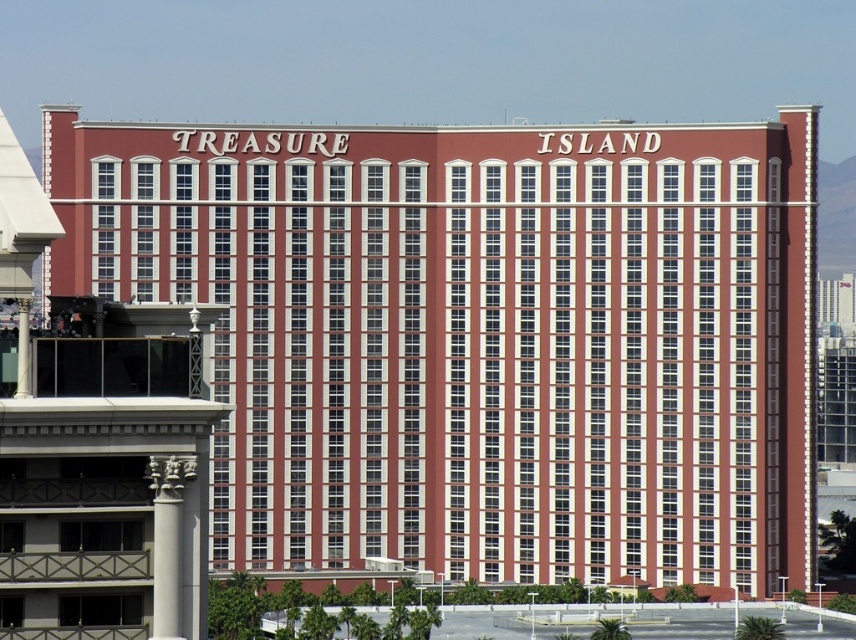
Question: Among these objects, which one is nearest to the camera?

Choices:
 (A) white glossy column at lower left
 (B) red brick building at center

Answer: (A)

Question: Can you confirm if red brick building at center is thinner than white glossy column at lower left?

Choices:
 (A) yes
 (B) no

Answer: (B)

Question: Is red brick building at center positioned behind white glossy column at lower left?

Choices:
 (A) no
 (B) yes

Answer: (B)

Question: Which of the following is the closest to the observer?

Choices:
 (A) red brick building at center
 (B) white glossy column at lower left

Answer: (B)

Question: Is red brick building at center positioned before white glossy column at lower left?

Choices:
 (A) yes
 (B) no

Answer: (B)